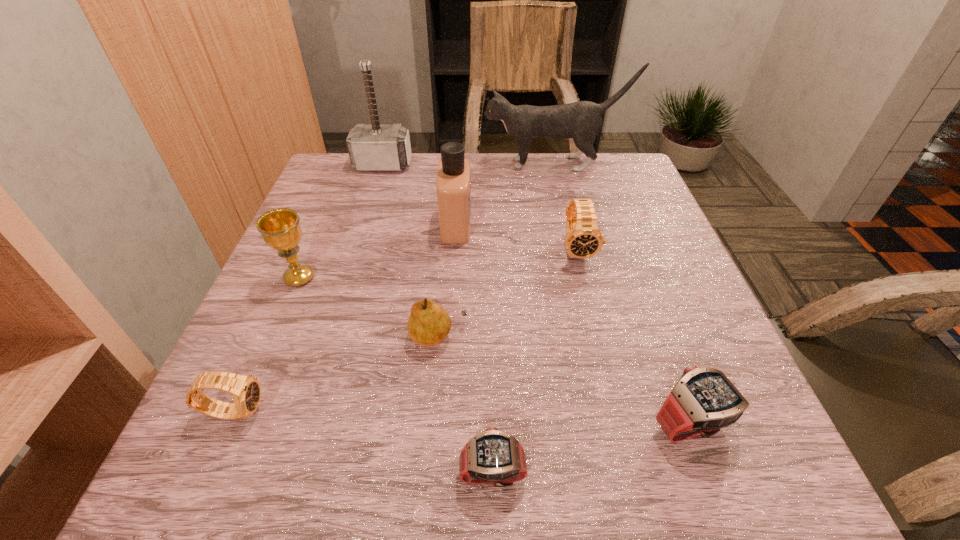
Find the location of a particular element. This screenshot has width=960, height=540. vacant region that satisfies the following two spatial constraints: 1. at the face of the cat; 2. on the back side of the right red watch is located at coordinates (616, 424).

Locate an element on the screen. vacant space that satisfies the following two spatial constraints: 1. on the front side of the sixth shortest object; 2. on the face of the leftmost watch is located at coordinates (243, 411).